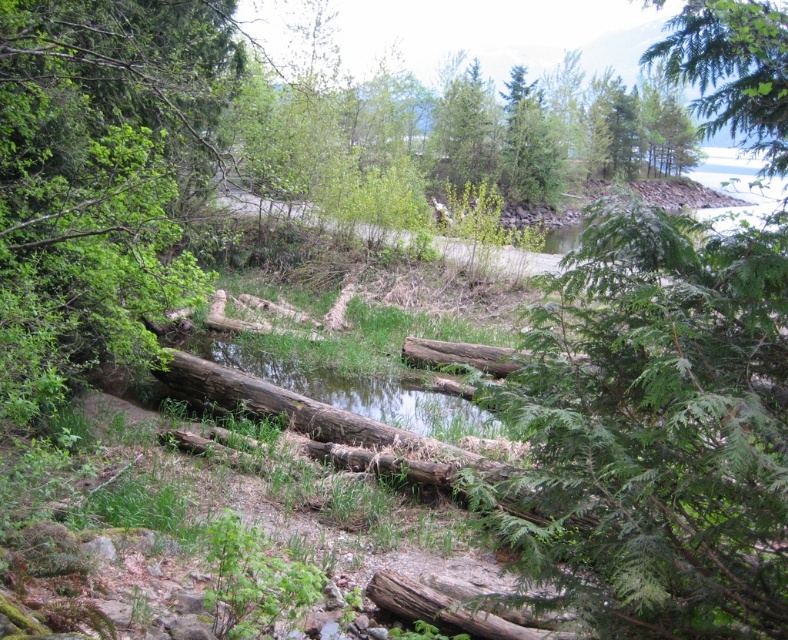
Is point (43, 218) positioned before point (775, 129)?

That is False.

Can you confirm if brown rough log at left is positioned below green leafy tree at upper right?

Indeed, brown rough log at left is positioned under green leafy tree at upper right.

Locate an element on the screen. brown rough log at left is located at coordinates (98, 177).